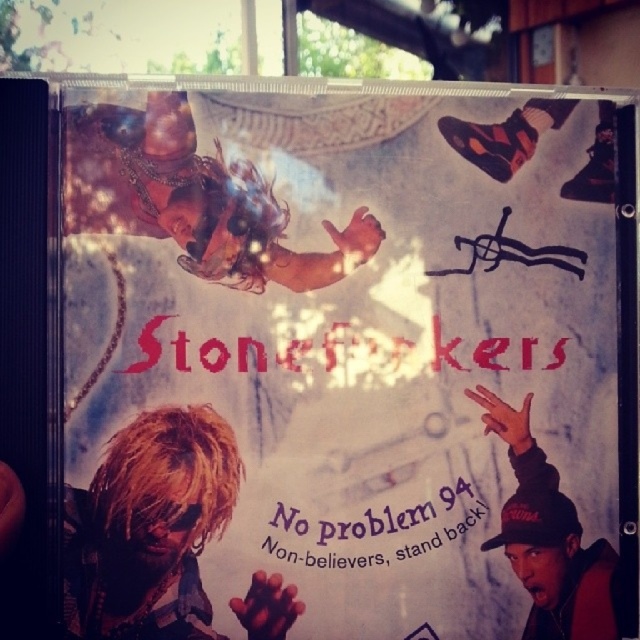
You are a graphic designer reviewing the CD cover for Stonefkers. You need to ensure that the blonde hair at lower left and the purple paper text at center are visually balanced. Given their sizes, which element might need adjustment to achieve balance?

The blonde hair at lower left has a greater height compared to the purple paper text at center, so the purple paper text at center might need to be enlarged or the blonde hair at lower left reduced in size to achieve visual balance.